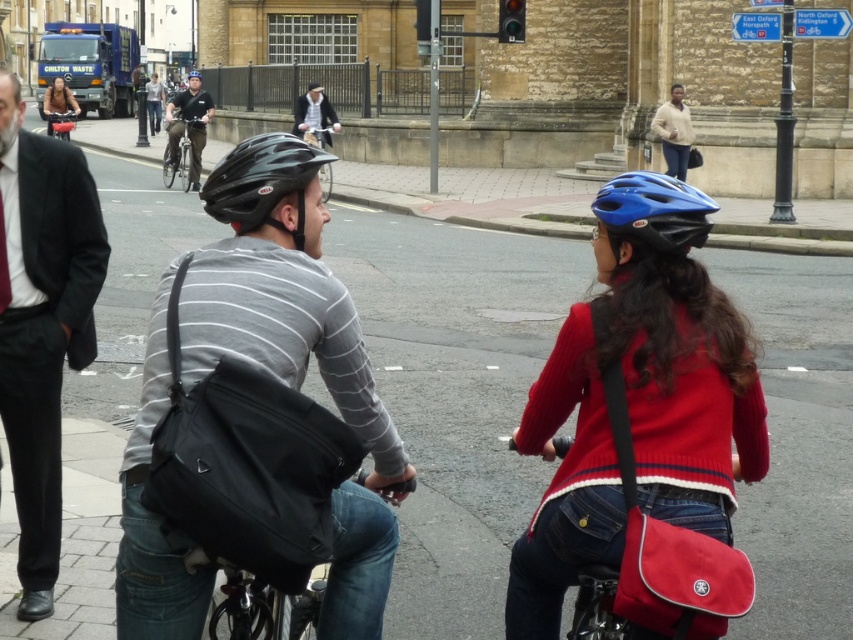
You are a delivery person needing to determine which item is taller between the light brown leather jacket at upper center and the matte black bicycle at upper left. Based on the scene, which one is taller?

The light brown leather jacket at upper center is taller than the matte black bicycle at upper left according to the description.